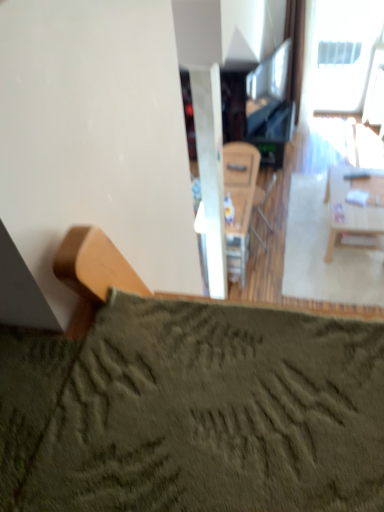
Question: Is white plastic window at upper right far from wooden armchair at center?

Choices:
 (A) no
 (B) yes

Answer: (B)

Question: Is white plastic window at upper right oriented towards wooden armchair at center?

Choices:
 (A) no
 (B) yes

Answer: (B)

Question: Is white plastic window at upper right oriented away from wooden armchair at center?

Choices:
 (A) no
 (B) yes

Answer: (A)

Question: From the image's perspective, does white plastic window at upper right appear higher than wooden armchair at center?

Choices:
 (A) no
 (B) yes

Answer: (B)

Question: Does white plastic window at upper right contain wooden armchair at center?

Choices:
 (A) yes
 (B) no

Answer: (B)

Question: Considering the relative sizes of white plastic window at upper right and wooden armchair at center in the image provided, is white plastic window at upper right thinner than wooden armchair at center?

Choices:
 (A) no
 (B) yes

Answer: (B)

Question: From the image's perspective, does light wood table at right appear lower than wooden armchair at center?

Choices:
 (A) no
 (B) yes

Answer: (B)

Question: Is wooden armchair at center located within light wood table at right?

Choices:
 (A) yes
 (B) no

Answer: (B)

Question: Does light wood table at right touch wooden armchair at center?

Choices:
 (A) no
 (B) yes

Answer: (A)

Question: Is light wood table at right at the left side of wooden armchair at center?

Choices:
 (A) no
 (B) yes

Answer: (A)

Question: Does light wood table at right have a lesser width compared to wooden armchair at center?

Choices:
 (A) yes
 (B) no

Answer: (B)

Question: Is light wood table at right to the right of wooden armchair at center from the viewer's perspective?

Choices:
 (A) yes
 (B) no

Answer: (A)

Question: Is light wood table at right surrounded by white plastic window at upper right?

Choices:
 (A) yes
 (B) no

Answer: (B)